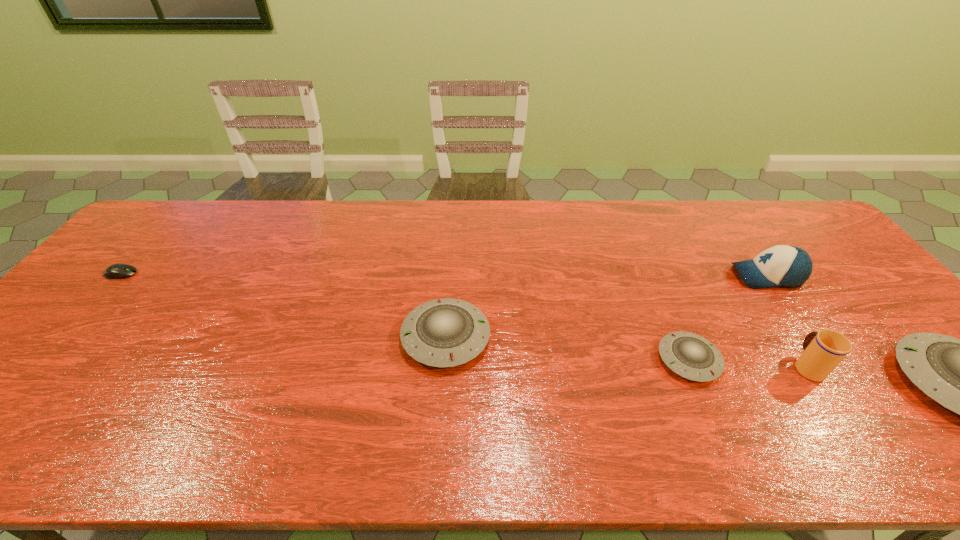
At what (x,y) coordinates should I click in order to perform the action: click on the third shortest object. Please return your answer as a coordinate pair (x, y). This screenshot has height=540, width=960. Looking at the image, I should click on (447, 332).

Image resolution: width=960 pixels, height=540 pixels. I want to click on the second shortest saucer, so click(447, 332).

You are a GUI agent. You are given a task and a screenshot of the screen. Output one action in this format:
    pyautogui.click(x=<x>, y=<y>)
    Task: Click on the fifth tallest object
    
    Given the screenshot: What is the action you would take?
    pyautogui.click(x=689, y=355)

What are the coordinates of `the fourth object from right to left` in the screenshot? It's located at (689, 355).

In order to click on baseball cap in this screenshot , I will do `click(782, 265)`.

The height and width of the screenshot is (540, 960). Identify the location of the shortest object. (116, 271).

Locate an element on the screen. Image resolution: width=960 pixels, height=540 pixels. the leftmost object is located at coordinates (116, 271).

Locate an element on the screen. Image resolution: width=960 pixels, height=540 pixels. cup is located at coordinates click(x=823, y=351).

Locate an element on the screen. vacant space located 0.060m on the left of the second object from left to right is located at coordinates (378, 337).

I want to click on vacant space located on the back of the second saucer from right to left, so click(669, 313).